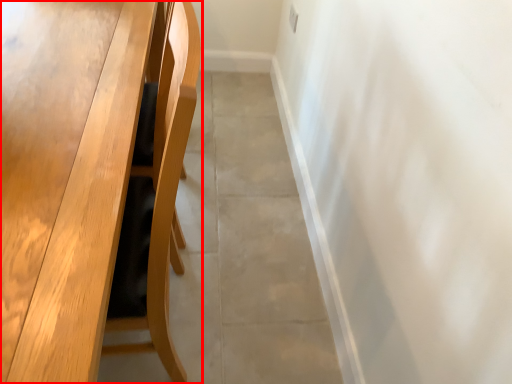
Question: In this image, where is table (annotated by the red box) located relative to concrete?

Choices:
 (A) right
 (B) left

Answer: (B)